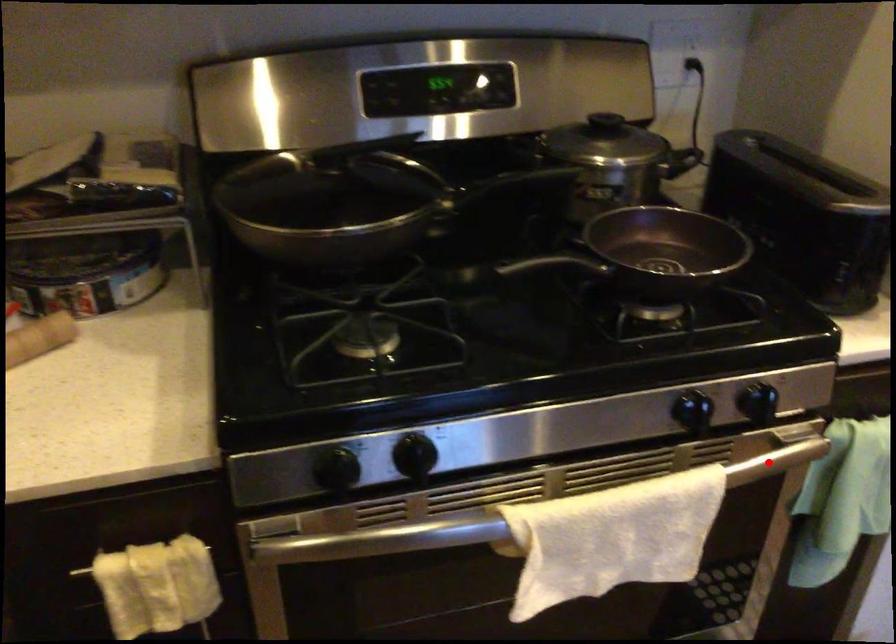
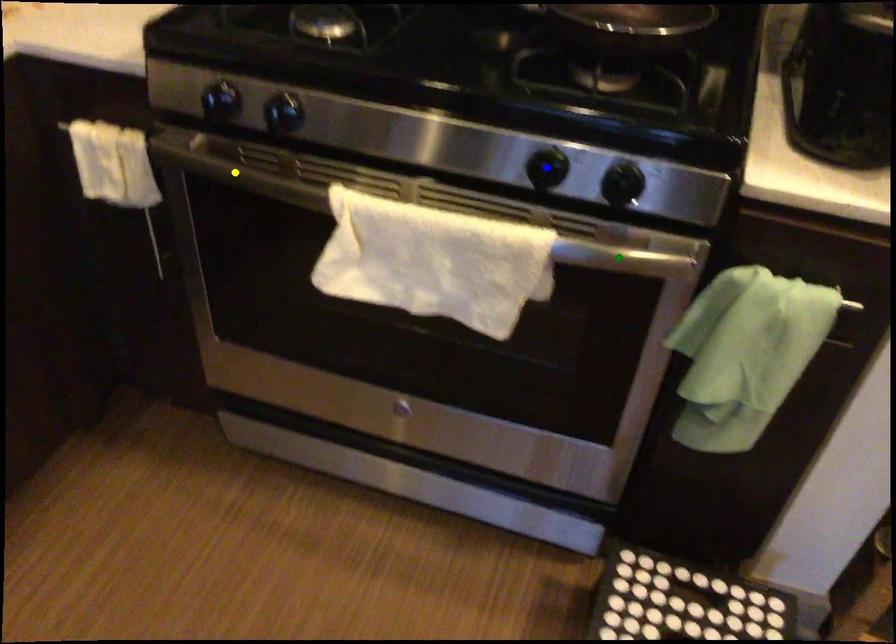
Question: I am providing you with two images of the same scene from different viewpoints. A red point is marked on the first image. You are given multiple points on the second image. Which point in image 2 is actually the same real-world point as the red point in image 1?

Choices:
 (A) yellow point
 (B) green point
 (C) blue point

Answer: (B)